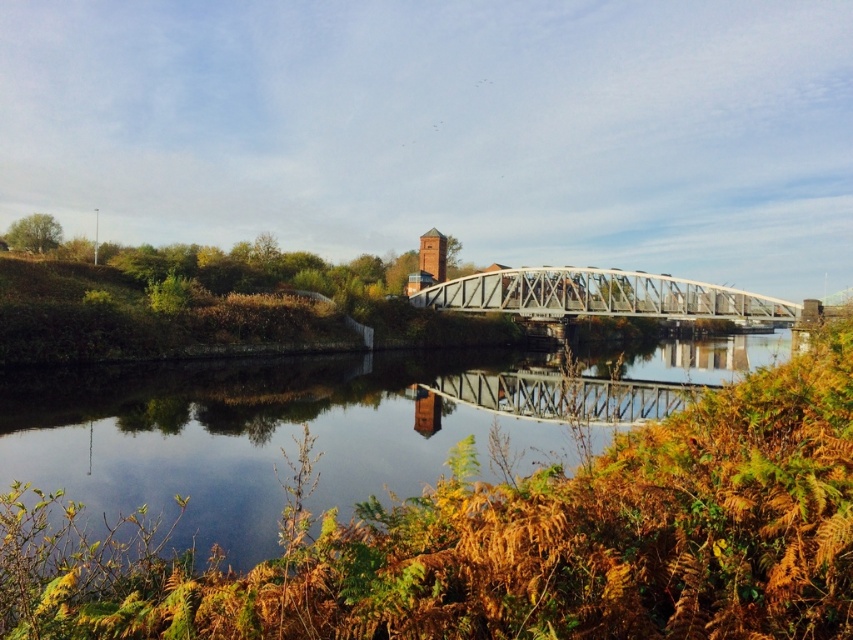
Question: Among these objects, which one is nearest to the camera?

Choices:
 (A) smooth reflective water at center
 (B) metallic gray bridge at center

Answer: (A)

Question: Does smooth reflective water at center appear under metallic gray bridge at center?

Choices:
 (A) yes
 (B) no

Answer: (A)

Question: Which object appears farthest from the camera in this image?

Choices:
 (A) metallic gray bridge at center
 (B) smooth reflective water at center

Answer: (A)

Question: Can you confirm if smooth reflective water at center is positioned above metallic gray bridge at center?

Choices:
 (A) yes
 (B) no

Answer: (B)

Question: Can you confirm if smooth reflective water at center is positioned to the left of metallic gray bridge at center?

Choices:
 (A) no
 (B) yes

Answer: (A)